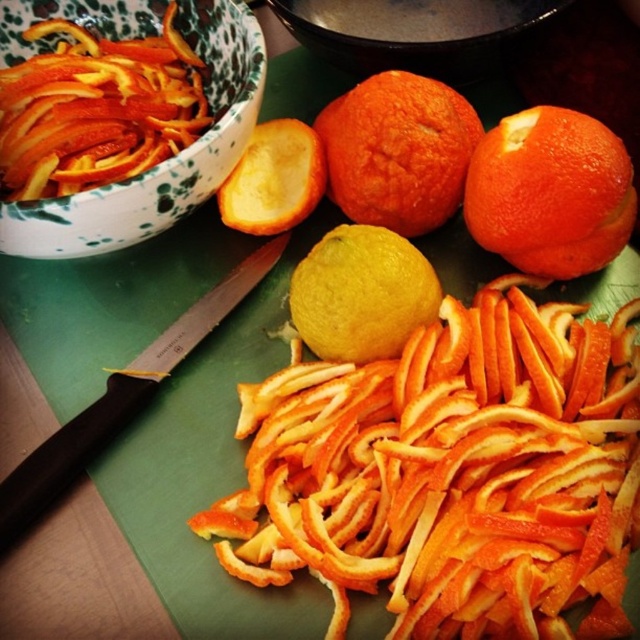
Question: Among these objects, which one is nearest to the camera?

Choices:
 (A) black plastic knife at upper left
 (B) orange matte at center
 (C) matte ceramic bowl at upper center

Answer: (A)

Question: Does orangesmoothorange at right have a greater width compared to orange matte at center?

Choices:
 (A) no
 (B) yes

Answer: (B)

Question: From the image, what is the correct spatial relationship of orangesmoothorange at center in relation to yellow matte lemon at center?

Choices:
 (A) above
 (B) below

Answer: (A)

Question: Among these points, which one is nearest to the camera?

Choices:
 (A) (148, 381)
 (B) (237, 188)
 (C) (8, 52)

Answer: (A)

Question: Is orangesmoothorange at center thinner than orange matte at center?

Choices:
 (A) yes
 (B) no

Answer: (B)

Question: Which of the following is the farthest from the observer?

Choices:
 (A) (19, 515)
 (B) (362, 122)
 (C) (116, 240)
 (D) (358, 29)

Answer: (D)